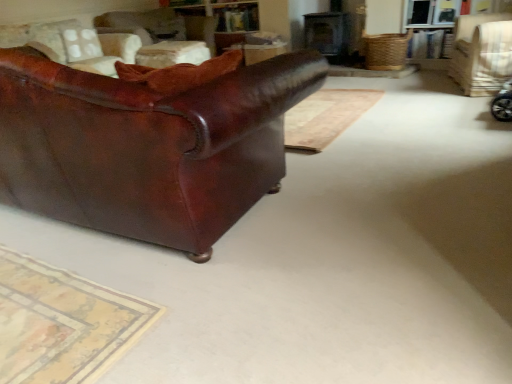
Question: Would you say leather couch at upper left, the second chair positioned from the right, is to the left or to the right of light beige fabric chair at upper right, which appears as the 3th chair when viewed from the left, in the picture?

Choices:
 (A) right
 (B) left

Answer: (B)

Question: Is leather couch at upper left, which is the second chair from left to right, inside or outside of light beige fabric chair at upper right, which is the 1th chair in right-to-left order?

Choices:
 (A) outside
 (B) inside

Answer: (A)

Question: Which object is the farthest from the wooden table at center?

Choices:
 (A) light beige fabric chair at upper right, which is the 1th chair in right-to-left order
 (B) leather couch at upper left, the second chair positioned from the right
 (C) leather couch at left, which appears as the first chair when viewed from the left
 (D) shiny brown leather couch at left

Answer: (D)

Question: Which object is the closest to the light beige fabric chair at upper right, which is the 1th chair in right-to-left order?

Choices:
 (A) shiny brown leather couch at left
 (B) leather couch at left, the 3th chair when ordered from right to left
 (C) leather couch at upper left, which is the second chair from left to right
 (D) wooden table at center

Answer: (D)